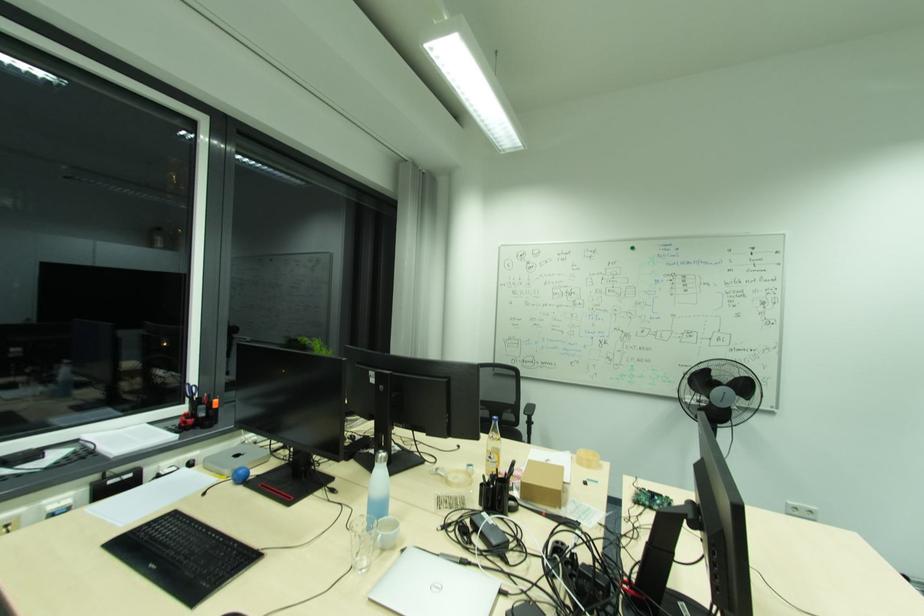
The location [800,511] corresponds to which object?

This point indicates the white wall outlet.